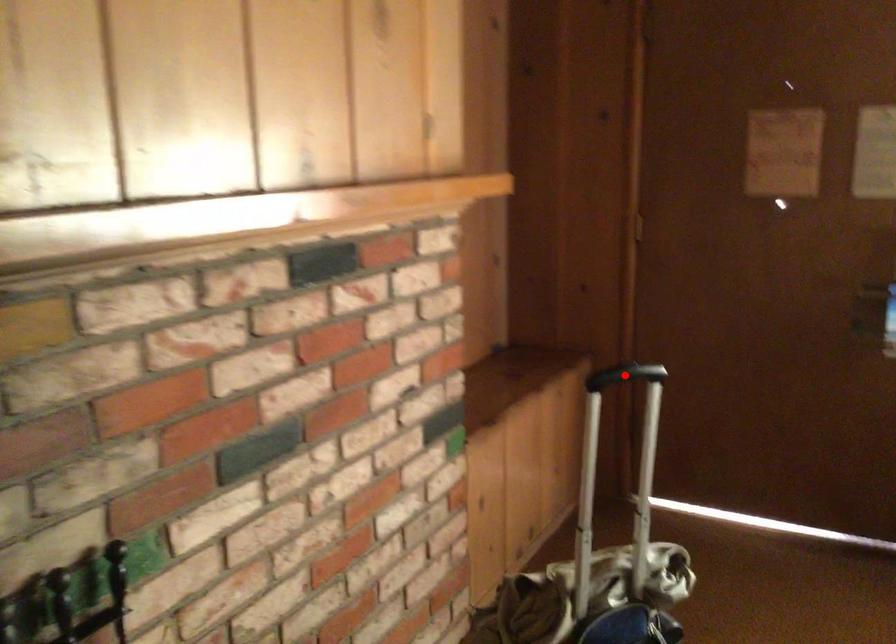
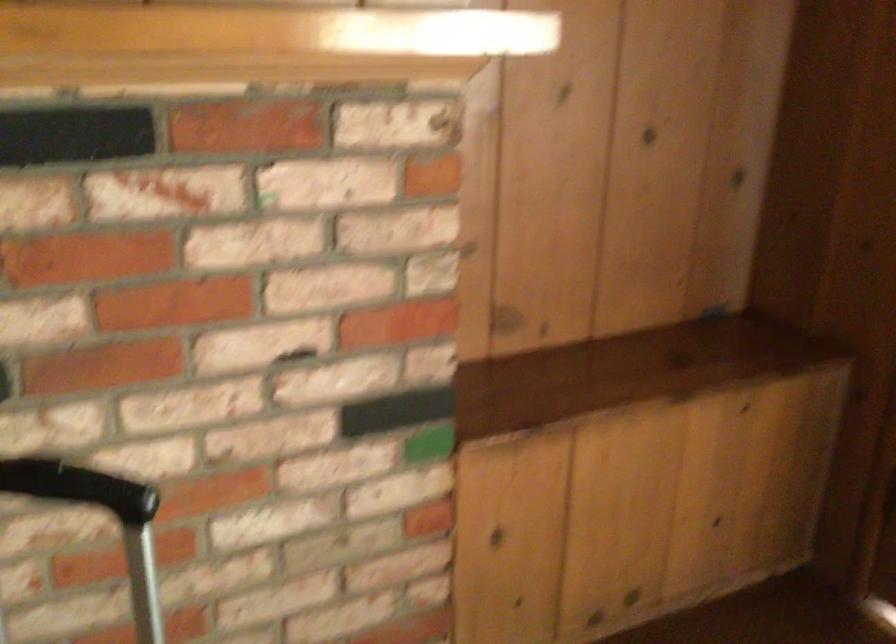
Where in the second image is the point corresponding to the highlighted location from the first image?

(138, 469)